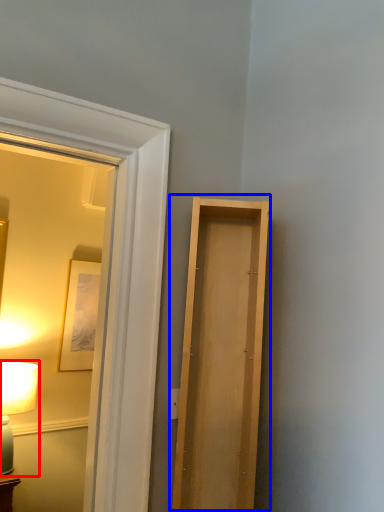
Question: Among these objects, which one is nearest to the camera, table lamp (highlighted by a red box) or door (highlighted by a blue box)?

Choices:
 (A) table lamp
 (B) door

Answer: (B)